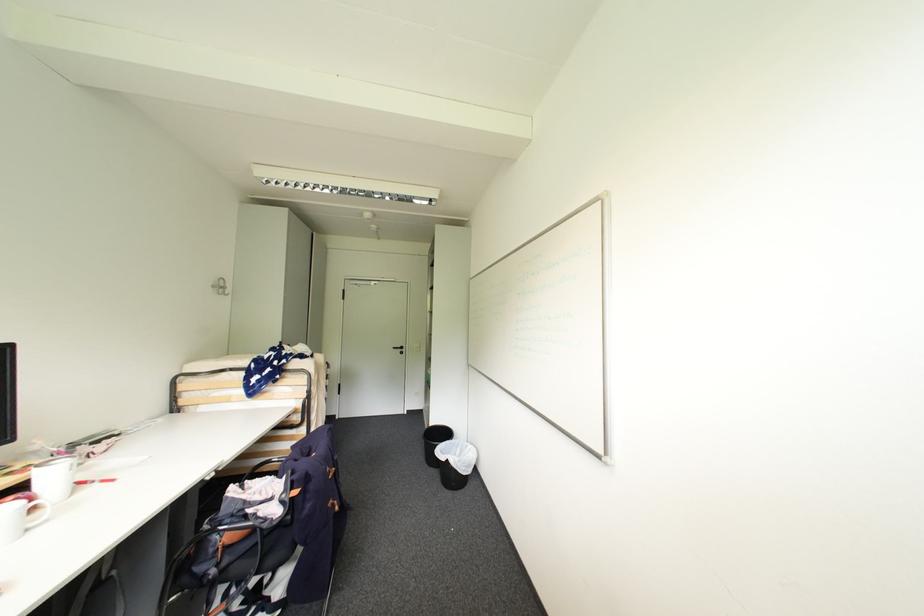
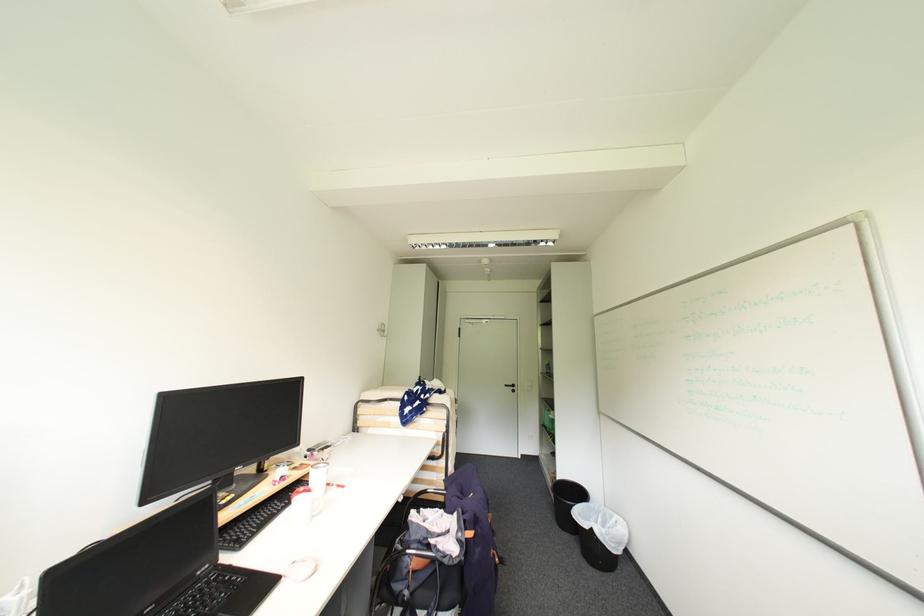
Where in the second image is the point corresponding to (400,349) from the first image?

(513, 387)